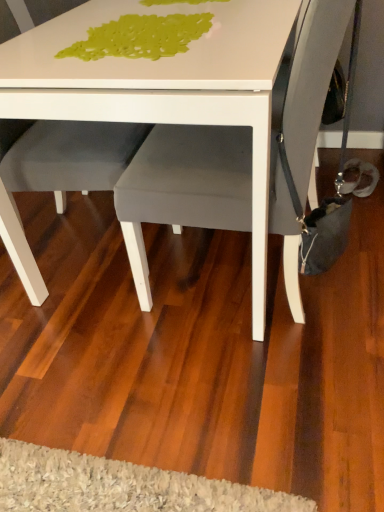
Locate an element on the screen. The height and width of the screenshot is (512, 384). free point in front of matte gray cushion at center is located at coordinates (241, 401).